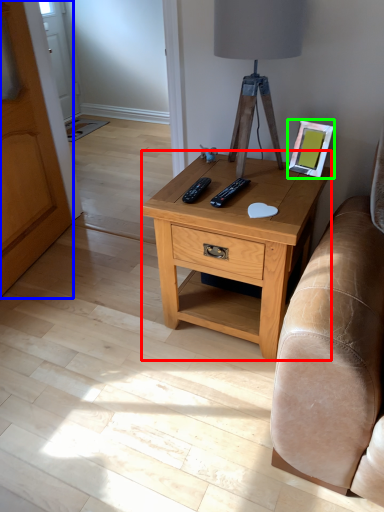
Question: Which object is positioned farthest from nightstand (highlighted by a red box)? Select from armoire (highlighted by a blue box) and picture frame (highlighted by a green box).

Choices:
 (A) armoire
 (B) picture frame

Answer: (A)